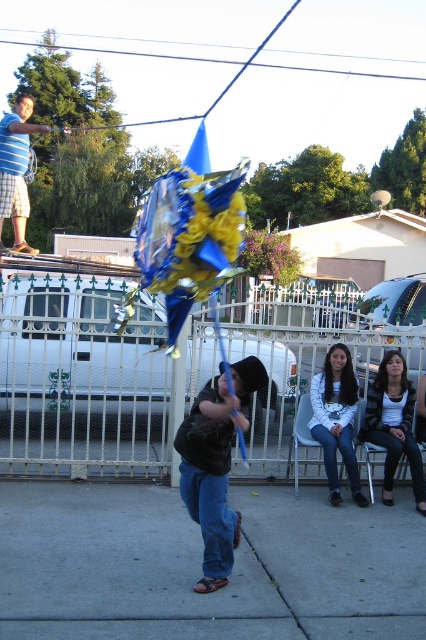
Between white metal fence at center and denim jeans at lower right, which one appears on the left side from the viewer's perspective?

white metal fence at center is more to the left.

Can you confirm if white metal fence at center is shorter than denim jeans at lower right?

Incorrect, white metal fence at center's height does not fall short of denim jeans at lower right's.

Describe the element at coordinates (92, 376) in the screenshot. The height and width of the screenshot is (640, 426). I see `white metal fence at center` at that location.

At what (x,y) coordinates should I click in order to perform the action: click on white metal fence at center. Please return your answer as a coordinate pair (x, y). This screenshot has width=426, height=640. Looking at the image, I should click on (92, 376).

Consider the image. Is striped sweater at lower right positioned behind brushed metal water at bottle left?

No, it is not.

Who is positioned more to the left, striped sweater at lower right or brushed metal water at bottle left?

brushed metal water at bottle left

Which is behind, point (406, 444) or point (19, 243)?

Positioned behind is point (19, 243).

Locate an element on the screen. The height and width of the screenshot is (640, 426). striped sweater at lower right is located at coordinates (394, 424).

From the picture: Can you confirm if gray concrete pavement at center is positioned to the left of striped sweater at lower right?

Indeed, gray concrete pavement at center is positioned on the left side of striped sweater at lower right.

Is point (92, 490) farther from camera compared to point (425, 492)?

Yes, it is behind point (425, 492).

I want to click on gray concrete pavement at center, so click(x=199, y=566).